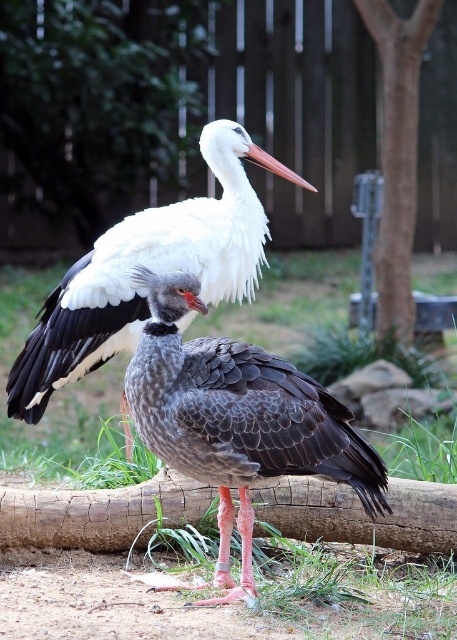
Question: Does gray matte feathers at center appear under white feathered stork at upper center?

Choices:
 (A) no
 (B) yes

Answer: (B)

Question: Which of the following is the closest to the observer?

Choices:
 (A) white feathered stork at upper center
 (B) gray matte feathers at center

Answer: (B)

Question: Can you confirm if gray matte feathers at center is positioned below white feathered stork at upper center?

Choices:
 (A) yes
 (B) no

Answer: (A)

Question: Does gray matte feathers at center have a greater width compared to white feathered stork at upper center?

Choices:
 (A) no
 (B) yes

Answer: (A)

Question: Which object is closer to the camera taking this photo?

Choices:
 (A) gray matte feathers at center
 (B) white feathered stork at upper center

Answer: (A)